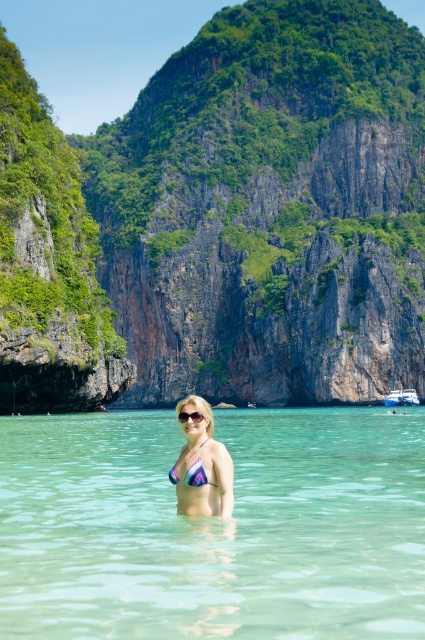
You are a photographer trying to capture a closeup shot of the multicolored fabric bikini at center. Your camera has a maximum focus range of 25 meters. Can you take the photo from your current position?

The multicolored fabric bikini at center and camera are 30.41 meters apart from each other, which exceeds the camera maximum focus range of 25 meters. You need to move closer to take the photo.

You are a photographer planning to capture a sunset shot from the white glossy boat at center. Considering the clear water at center is taller than the boat, will the boat be fully visible above the water when positioned at the center?

The clear water at center has a greater height compared to the white glossy boat at center, meaning the boat will be partially submerged and not fully visible above the water when positioned at the center.